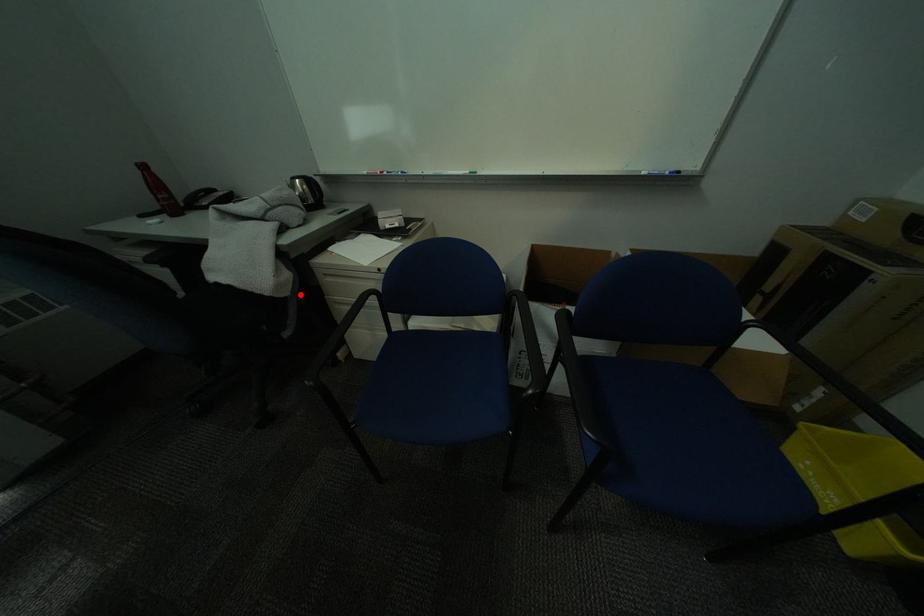
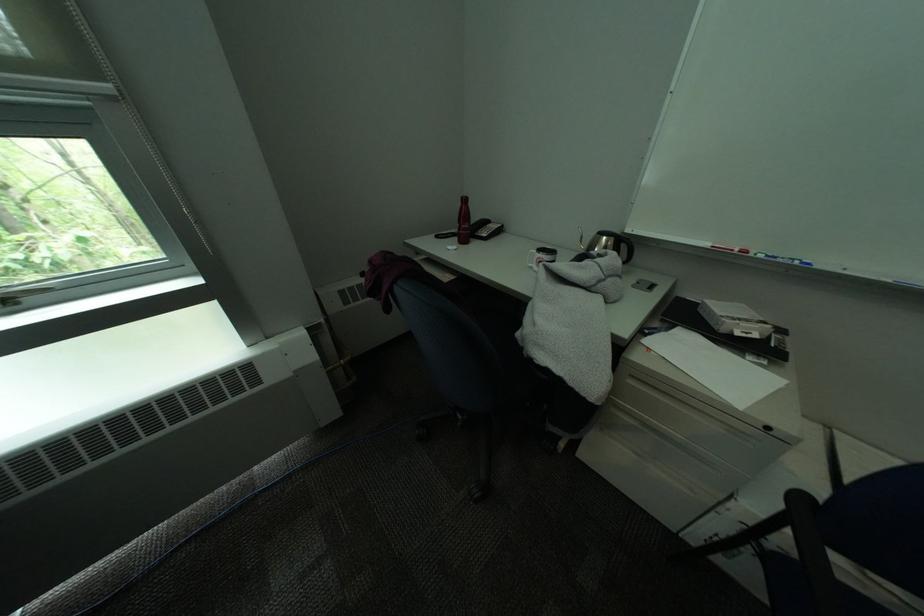
Question: I am providing you with two images of the same scene from different viewpoints. Image1 has a red point marked. In image2, the corresponding 3D location appears at what relative position? Reply with the corresponding letter.

Choices:
 (A) Closer
 (B) Farther

Answer: (B)